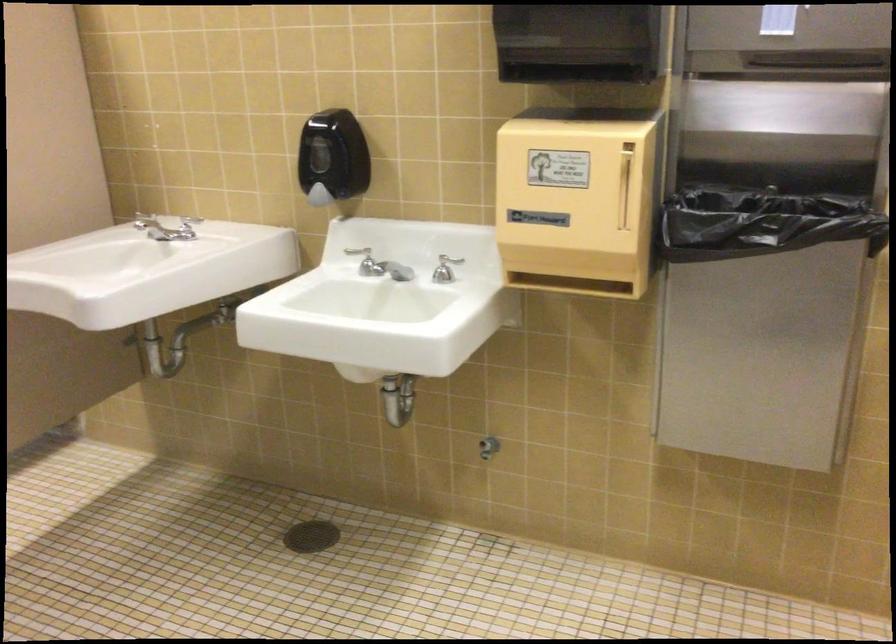
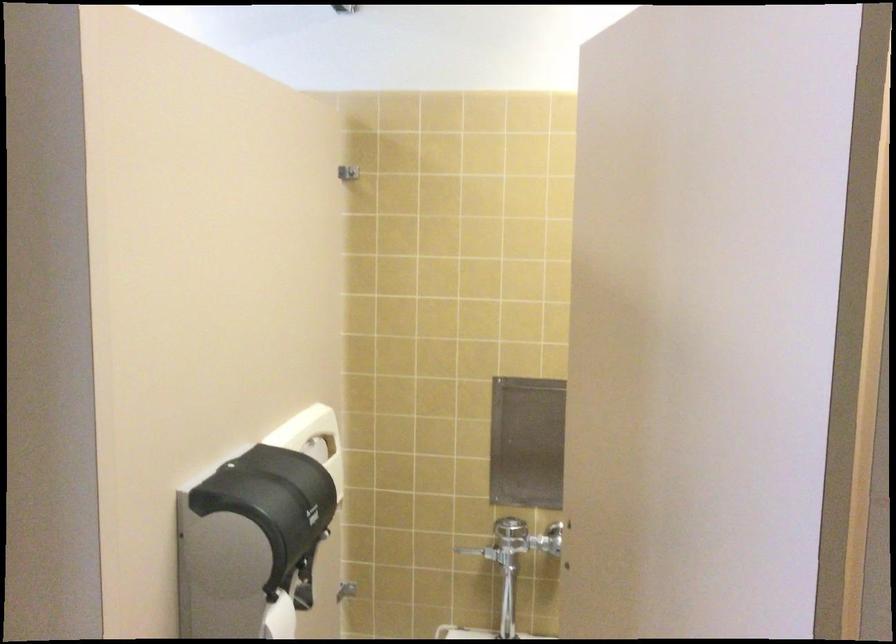
Question: What movement of the cameraman would produce the second image?

Choices:
 (A) Left
 (B) Right
 (C) Forward
 (D) Backward

Answer: (A)